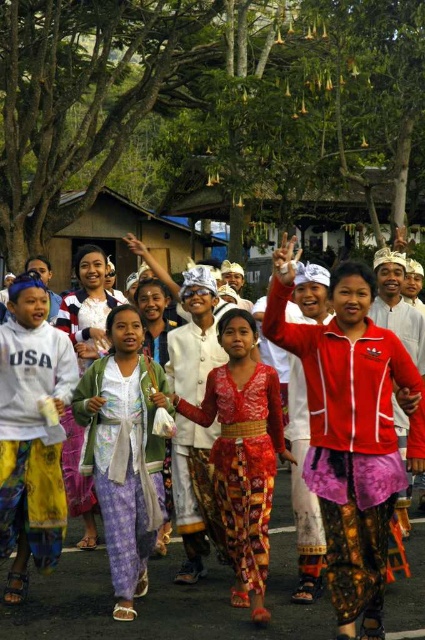
Which of these two, light purple batik pants at center or bright red batik dress at center, stands taller?

Standing taller between the two is light purple batik pants at center.

Between light purple batik pants at center and bright red batik dress at center, which one appears on the right side from the viewer's perspective?

Positioned to the right is bright red batik dress at center.

What do you see at coordinates (124, 452) in the screenshot?
I see `light purple batik pants at center` at bounding box center [124, 452].

Identify the location of light purple batik pants at center. This screenshot has height=640, width=425. (124, 452).

Can you confirm if red satin dress at center is bigger than bright red batik dress at center?

Actually, red satin dress at center might be smaller than bright red batik dress at center.

Based on the photo, does red satin dress at center appear under bright red batik dress at center?

Correct, red satin dress at center is located below bright red batik dress at center.

This screenshot has width=425, height=640. What are the coordinates of `red satin dress at center` in the screenshot? It's located at (166, 596).

I want to click on red satin dress at center, so click(x=166, y=596).

Can you confirm if red matte jacket at center is positioned to the left of bright red batik dress at center?

Incorrect, red matte jacket at center is not on the left side of bright red batik dress at center.

Does red matte jacket at center have a larger size compared to bright red batik dress at center?

Correct, red matte jacket at center is larger in size than bright red batik dress at center.

You are a GUI agent. You are given a task and a screenshot of the screen. Output one action in this format:
    pyautogui.click(x=<x>, y=<y>)
    Task: Click on the red matte jacket at center
    Image resolution: width=425 pixels, height=640 pixels.
    Given the screenshot: What is the action you would take?
    pyautogui.click(x=348, y=429)

Locate an element on the screen. red matte jacket at center is located at coordinates (348, 429).